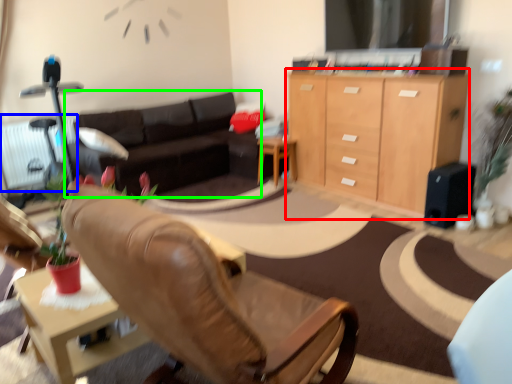
Question: Estimate the real-world distances between objects in this image. Which object is closer to cabinetry (highlighted by a red box), radiator (highlighted by a blue box) or studio couch (highlighted by a green box)?

Choices:
 (A) radiator
 (B) studio couch

Answer: (B)